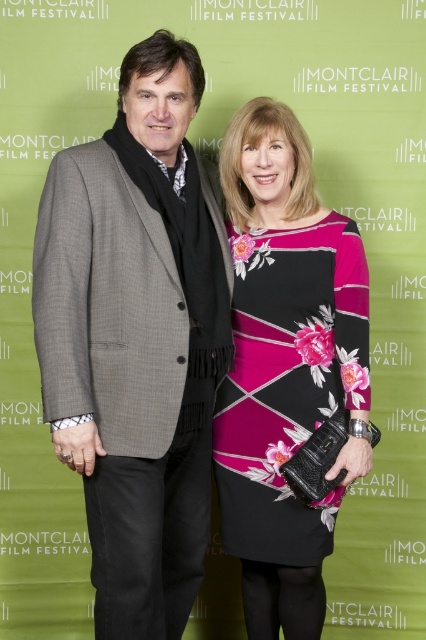
Which is above, gray wool blazer at center or floral-patterned dress at center?

gray wool blazer at center is higher up.

Which is in front, point (155, 90) or point (249, 540)?

Point (155, 90)

At what (x,y) coordinates should I click in order to perform the action: click on gray wool blazer at center. Please return your answer as a coordinate pair (x, y). The width and height of the screenshot is (426, 640). Looking at the image, I should click on (137, 339).

At what (x,y) coordinates should I click in order to perform the action: click on gray wool blazer at center. Please return your answer as a coordinate pair (x, y). The width and height of the screenshot is (426, 640). Looking at the image, I should click on (137, 339).